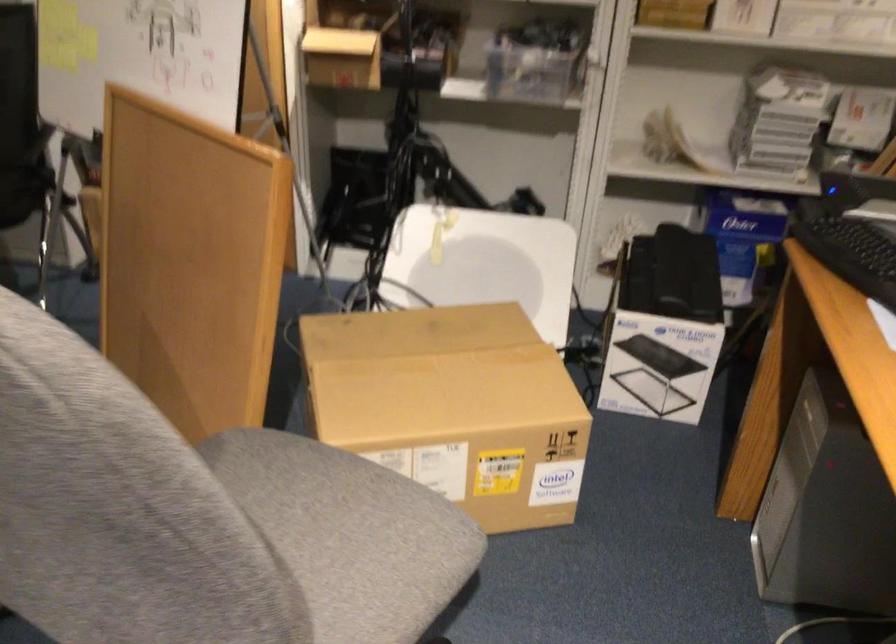
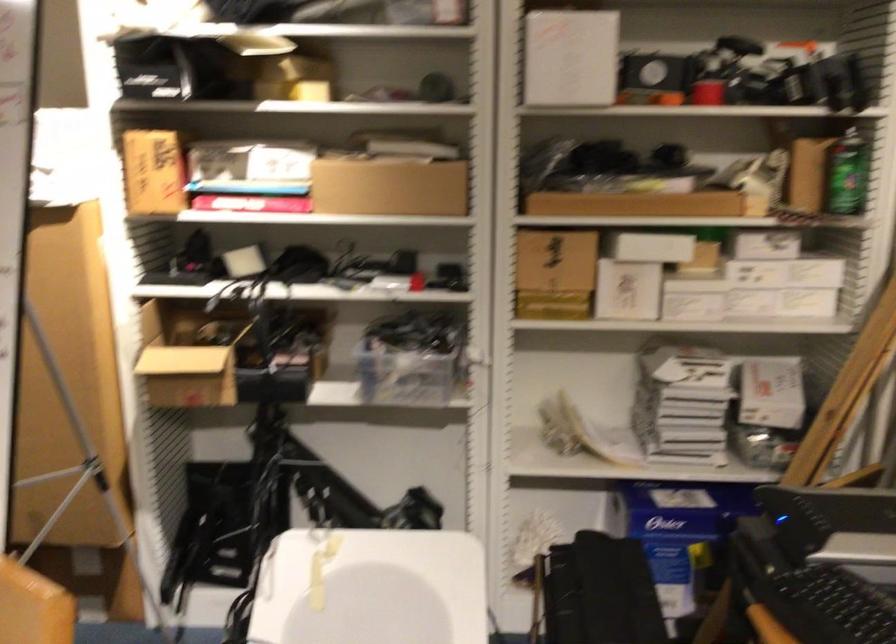
Question: Based on the continuous images, in which direction is the camera rotating? Reply with the corresponding letter.

Choices:
 (A) Left
 (B) Right
 (C) Up
 (D) Down

Answer: (C)